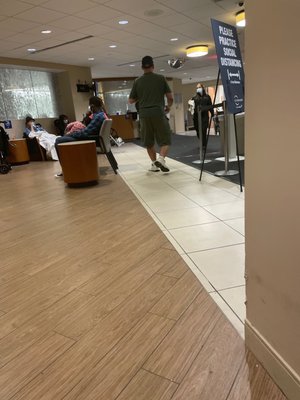
Locate an element on the screen. Image resolution: width=300 pixels, height=400 pixels. wall is located at coordinates (281, 271).